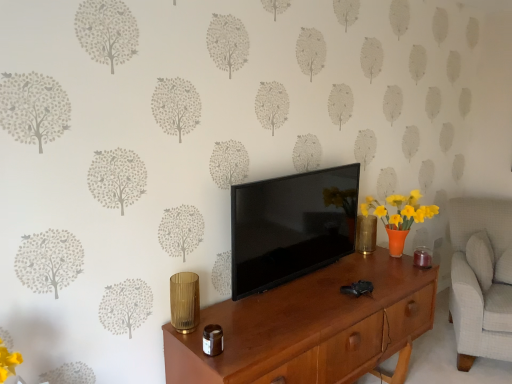
Locate an element on the screen. The height and width of the screenshot is (384, 512). vacant space underneath black glossy tv at center (from a real-world perspective) is located at coordinates [x=298, y=276].